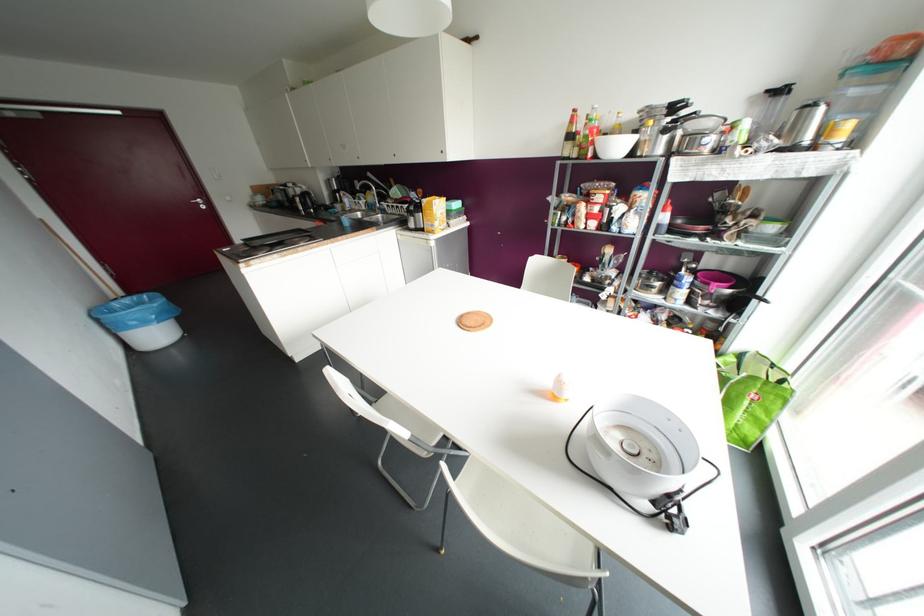
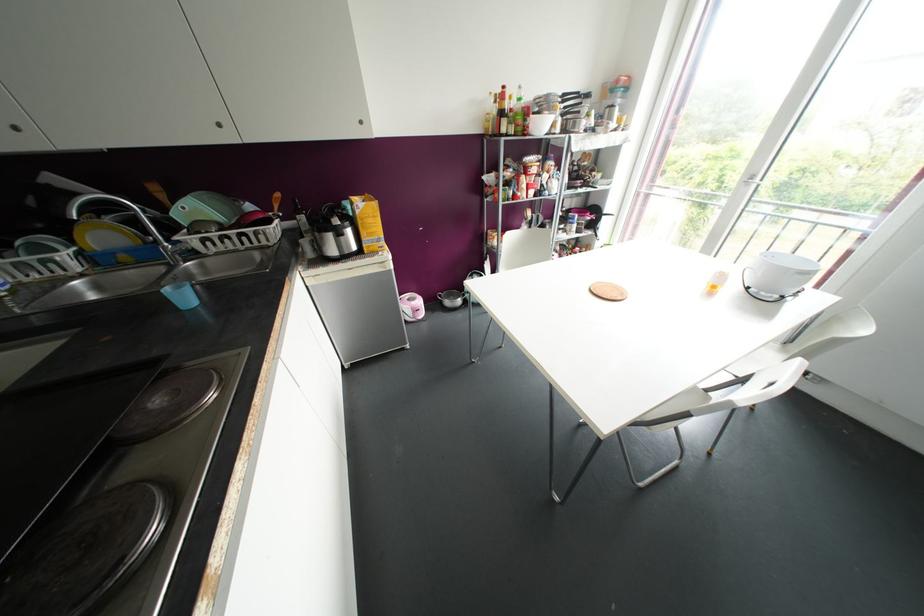
Locate, in the second image, the point that corresponds to pixel 345 222 in the first image.

(184, 297)